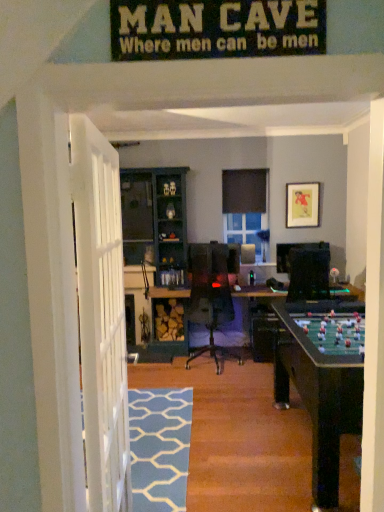
Question: From the image's perspective, would you say green felt table at center is shown under blue painted wood cabinet at center?

Choices:
 (A) yes
 (B) no

Answer: (A)

Question: Is the position of green felt table at center more distant than that of blue painted wood cabinet at center?

Choices:
 (A) no
 (B) yes

Answer: (A)

Question: Is green felt table at center wider than blue painted wood cabinet at center?

Choices:
 (A) yes
 (B) no

Answer: (A)

Question: Is green felt table at center next to blue painted wood cabinet at center and touching it?

Choices:
 (A) no
 (B) yes

Answer: (A)

Question: Is green felt table at center at the right side of blue painted wood cabinet at center?

Choices:
 (A) yes
 (B) no

Answer: (A)

Question: Can you confirm if green felt table at center is taller than blue painted wood cabinet at center?

Choices:
 (A) no
 (B) yes

Answer: (A)

Question: Considering the relative sizes of blue painted wood cabinet at center and blue textured rug at lower center in the image provided, is blue painted wood cabinet at center smaller than blue textured rug at lower center?

Choices:
 (A) yes
 (B) no

Answer: (B)

Question: Is blue painted wood cabinet at center to the right of blue textured rug at lower center from the viewer's perspective?

Choices:
 (A) yes
 (B) no

Answer: (B)

Question: From the image's perspective, does blue painted wood cabinet at center appear higher than blue textured rug at lower center?

Choices:
 (A) no
 (B) yes

Answer: (B)

Question: From a real-world perspective, is blue painted wood cabinet at center below blue textured rug at lower center?

Choices:
 (A) no
 (B) yes

Answer: (A)

Question: Is blue textured rug at lower center a part of blue painted wood cabinet at center?

Choices:
 (A) no
 (B) yes

Answer: (A)

Question: Is blue painted wood cabinet at center thinner than blue textured rug at lower center?

Choices:
 (A) yes
 (B) no

Answer: (A)

Question: Is matte paper picture frame at upper right wider than blue textured rug at lower center?

Choices:
 (A) yes
 (B) no

Answer: (B)